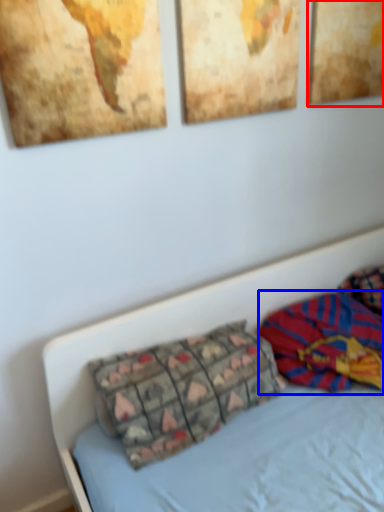
Question: Which point is further to the camera, picture frame (highlighted by a red box) or material (highlighted by a blue box)?

Choices:
 (A) picture frame
 (B) material

Answer: (A)